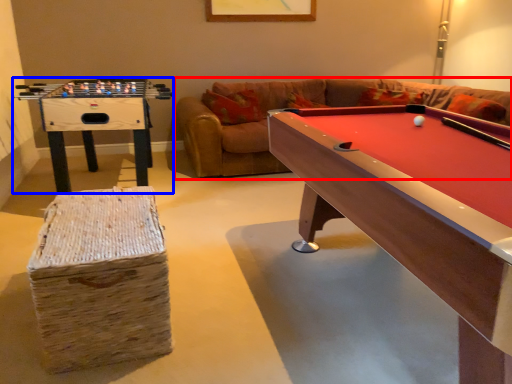
Question: Which of the following is the farthest to the observer, couch (highlighted by a red box) or table (highlighted by a blue box)?

Choices:
 (A) couch
 (B) table

Answer: (A)